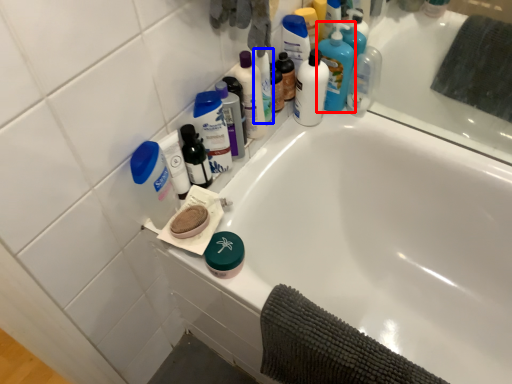
Question: Which object is further to the camera taking this photo, cleaning product (highlighted by a red box) or cleaning product (highlighted by a blue box)?

Choices:
 (A) cleaning product
 (B) cleaning product

Answer: (A)